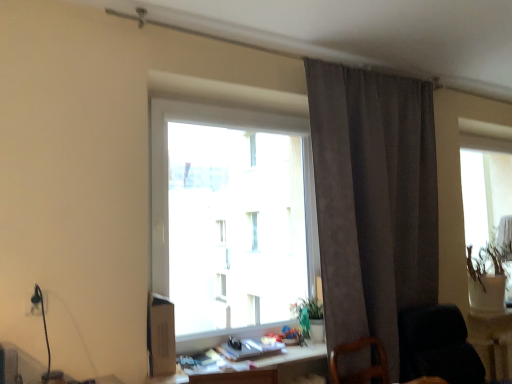
Question: From a real-world perspective, is green matte vase at right positioned under transparent glass window at center based on gravity?

Choices:
 (A) no
 (B) yes

Answer: (B)

Question: From the image's perspective, is green matte vase at right located above transparent glass window at center?

Choices:
 (A) no
 (B) yes

Answer: (A)

Question: Is green matte vase at right wider than transparent glass window at center?

Choices:
 (A) no
 (B) yes

Answer: (B)

Question: Is green matte vase at right smaller than transparent glass window at center?

Choices:
 (A) no
 (B) yes

Answer: (B)

Question: Considering the relative sizes of green matte vase at right and transparent glass window at center in the image provided, is green matte vase at right taller than transparent glass window at center?

Choices:
 (A) no
 (B) yes

Answer: (A)

Question: Can we say green matte vase at right lies outside transparent glass window at center?

Choices:
 (A) yes
 (B) no

Answer: (A)

Question: Is suede-like gray curtain at upper right oriented towards transparent glass window at center?

Choices:
 (A) no
 (B) yes

Answer: (A)

Question: Is suede-like gray curtain at upper right facing away from transparent glass window at center?

Choices:
 (A) yes
 (B) no

Answer: (B)

Question: From the image's perspective, is suede-like gray curtain at upper right over transparent glass window at center?

Choices:
 (A) yes
 (B) no

Answer: (B)

Question: Considering the relative sizes of suede-like gray curtain at upper right and transparent glass window at center in the image provided, is suede-like gray curtain at upper right wider than transparent glass window at center?

Choices:
 (A) yes
 (B) no

Answer: (A)

Question: Is suede-like gray curtain at upper right bigger than transparent glass window at center?

Choices:
 (A) yes
 (B) no

Answer: (A)

Question: Considering the relative sizes of suede-like gray curtain at upper right and transparent glass window at center in the image provided, is suede-like gray curtain at upper right shorter than transparent glass window at center?

Choices:
 (A) no
 (B) yes

Answer: (A)

Question: Is wooden table at lower right, the first table ordered from the bottom, to the left of transparent glass window at center from the viewer's perspective?

Choices:
 (A) no
 (B) yes

Answer: (A)